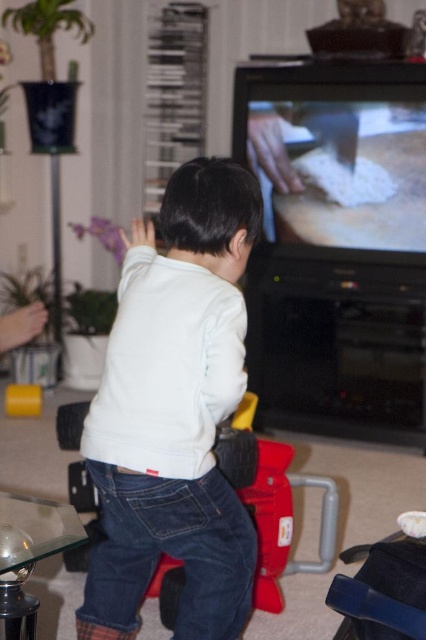
You are a parent trying to ensure your child stays within the play area. The white matte shirt at center and the red plastic toy car at center are both in the center of the room. Which object is positioned to the left of the other?

The white matte shirt at center is to the left of the red plastic toy car at center according to the description.

Where is the white matte shirt at center located in the image?

The white matte shirt at center is located at point 0.645 on the x axis and 0.411 on the y axis.